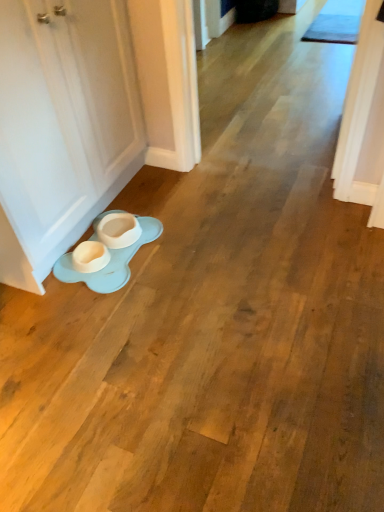
The image size is (384, 512). What are the coordinates of `vacant area in front of white matte door at lower left` in the screenshot? It's located at (127, 325).